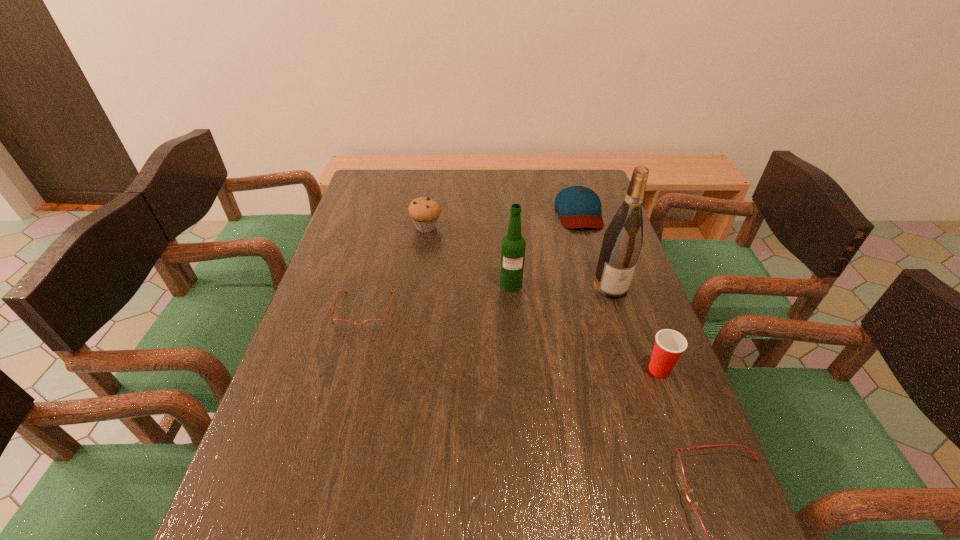
This screenshot has width=960, height=540. What are the coordinates of `free space that is in between the left spectacles and the second object from left to right` in the screenshot? It's located at (396, 269).

Find the location of a particular element. The image size is (960, 540). the closest object to the wine bottle is located at coordinates (513, 247).

Locate an element on the screen. This screenshot has height=540, width=960. object identified as the closest to the sixth object from right to left is located at coordinates (374, 323).

This screenshot has height=540, width=960. In order to click on vacant space that satisfies the following two spatial constraints: 1. on the label of the third object from left to right; 2. on the left side of the wine bottle in this screenshot , I will do `click(512, 287)`.